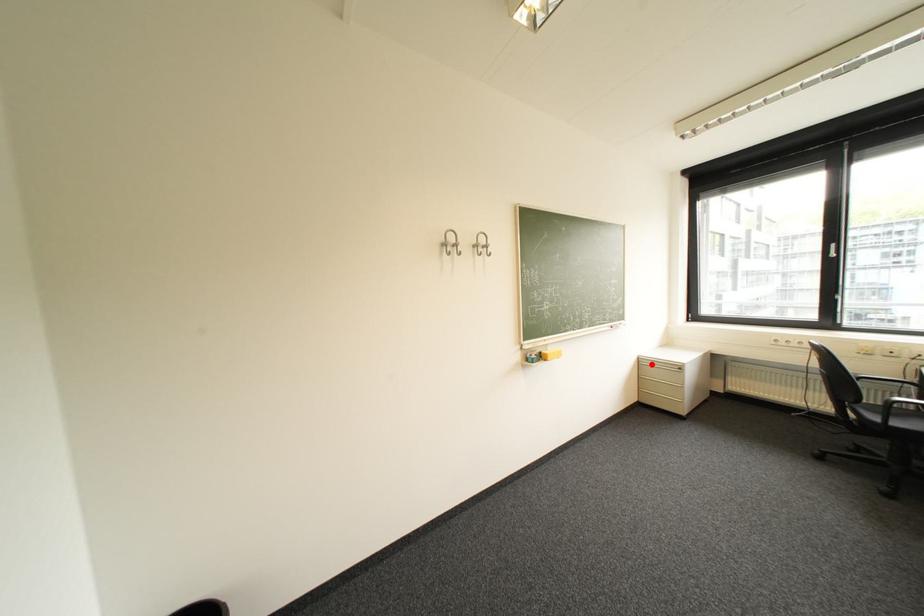
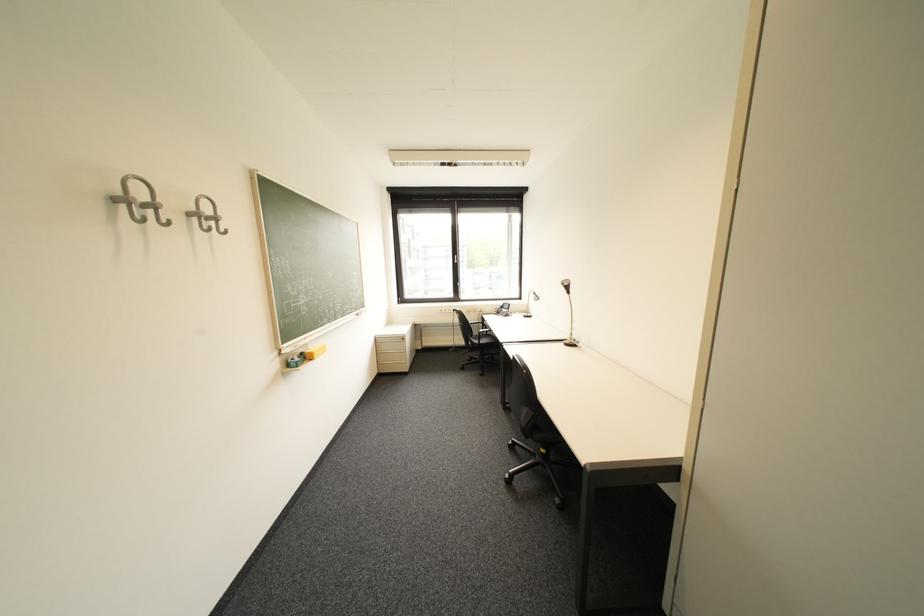
Question: I am providing you with two images of the same scene from different viewpoints. Given a red point in image1, look at the same physical point in image2. Is it:

Choices:
 (A) Closer to the viewpoint
 (B) Farther from the viewpoint

Answer: (B)